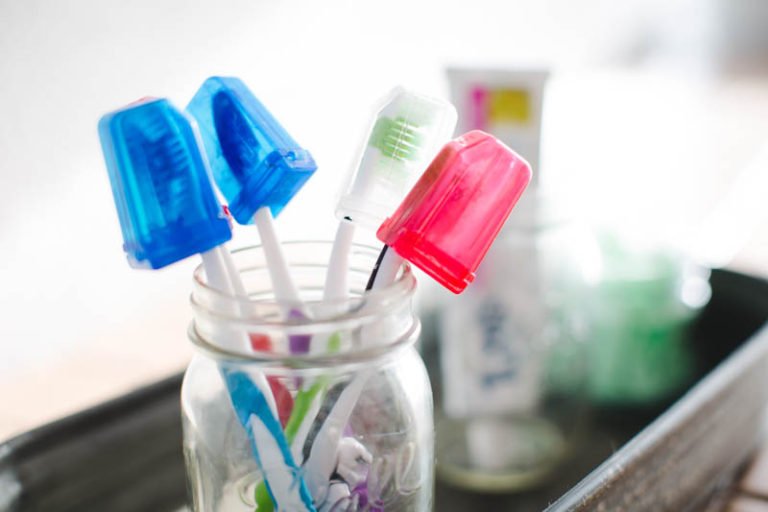
You are a GUI agent. You are given a task and a screenshot of the screen. Output one action in this format:
    pyautogui.click(x=<x>, y=<y>)
    Task: Click on the black countertop
    The width and height of the screenshot is (768, 512).
    Given the screenshot: What is the action you would take?
    pyautogui.click(x=133, y=440)